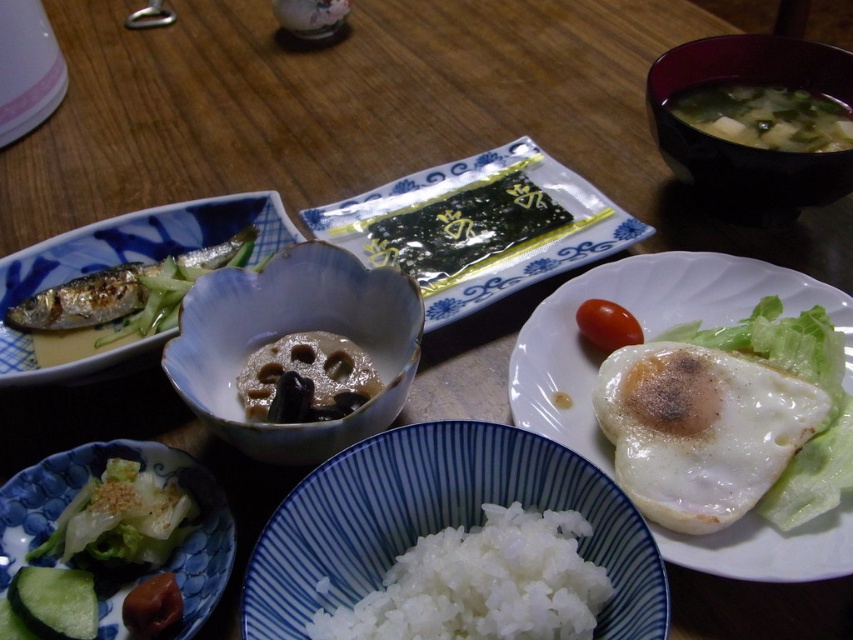
From the picture: You are a food critic trying to determine the presentation of the dishes. Which object, the matte ceramic bowl at center or the shiny silver fish at upper left, has a more slender shape?

The matte ceramic bowl at center is thinner than the shiny silver fish at upper left, so the matte ceramic bowl at center has a more slender shape.